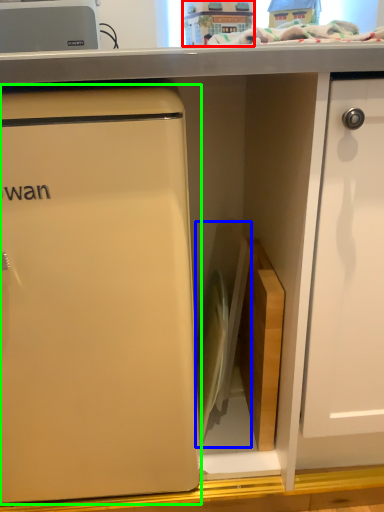
Question: Considering the real-world distances, which object is closest to toy (highlighted by a red box)? appliance (highlighted by a blue box) or refrigerator (highlighted by a green box).

Choices:
 (A) appliance
 (B) refrigerator

Answer: (A)